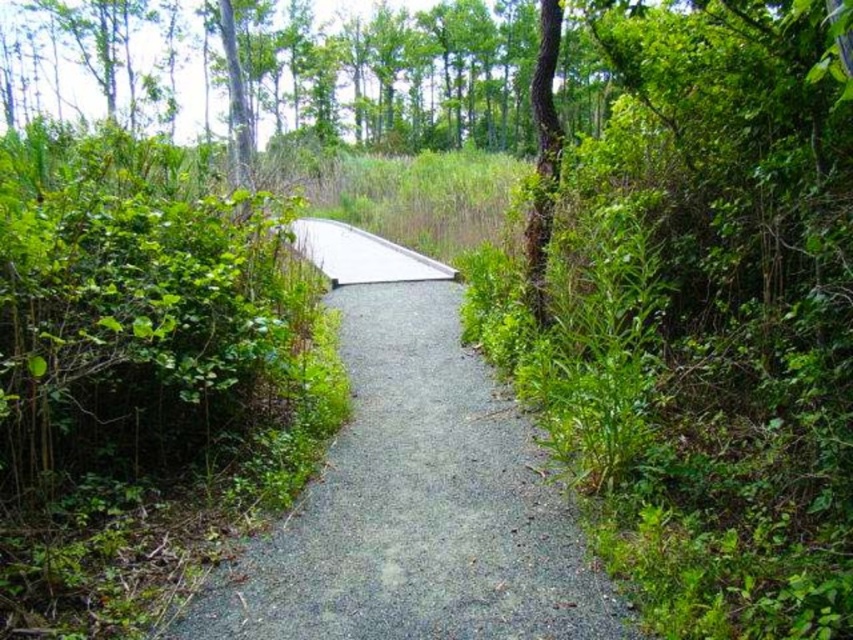
Where is `gravel path at center`? Image resolution: width=853 pixels, height=640 pixels. gravel path at center is located at coordinates (412, 488).

Between gravel path at center and brown rough bark tree at right, which one has less height?

Standing shorter between the two is gravel path at center.

Is point (606, 593) less distant than point (556, 10)?

Yes.

I want to click on gravel path at center, so [x=412, y=488].